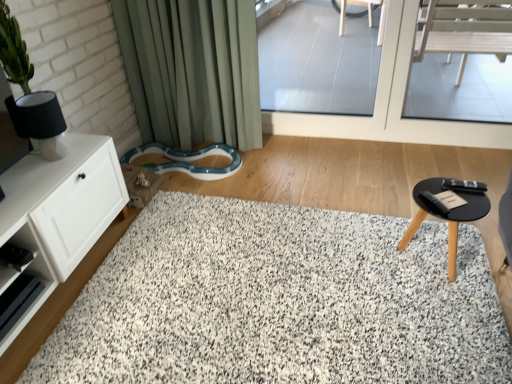
The image size is (512, 384). I want to click on blank area beneath transparent glass door at upper center, the 2th window screen from the right (from a real-world perspective), so click(315, 137).